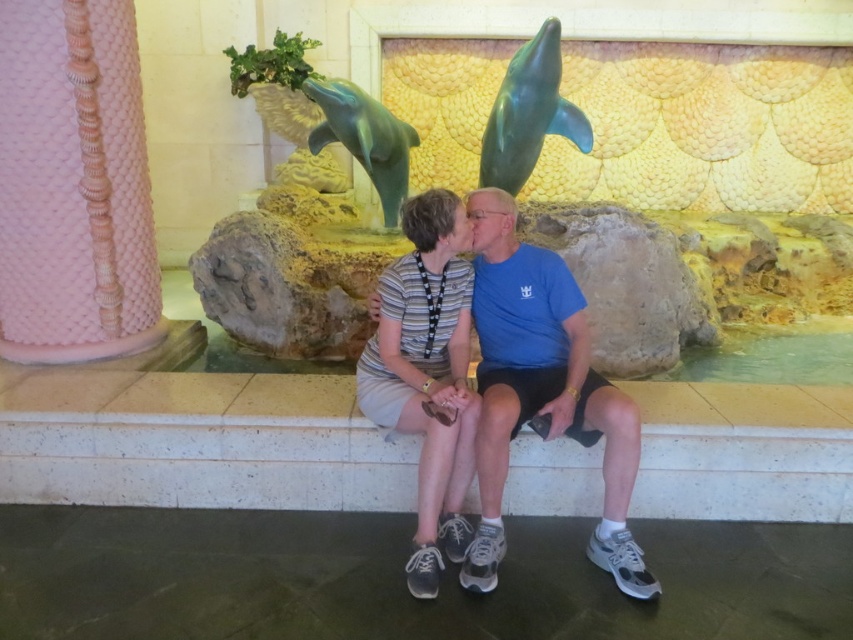
Is shiny green dolphin at upper center shorter than shiny green dolphin at center?

Indeed, shiny green dolphin at upper center has a lesser height compared to shiny green dolphin at center.

Is point (485, 168) positioned behind point (384, 122)?

Yes, it is.

Identify the location of shiny green dolphin at upper center. The width and height of the screenshot is (853, 640). (529, 113).

Can you confirm if blue cotton shirt at center is smaller than striped fabric dress at center?

No, blue cotton shirt at center is not smaller than striped fabric dress at center.

Who is more forward, (608, 429) or (408, 396)?

Point (608, 429) is more forward.

Find the location of a particular element. blue cotton shirt at center is located at coordinates (543, 390).

Does blue cotton shirt at center have a lesser height compared to shiny green dolphin at upper center?

No.

Locate an element on the screen. blue cotton shirt at center is located at coordinates (543, 390).

Where is `blue cotton shirt at center`? The image size is (853, 640). blue cotton shirt at center is located at coordinates (543, 390).